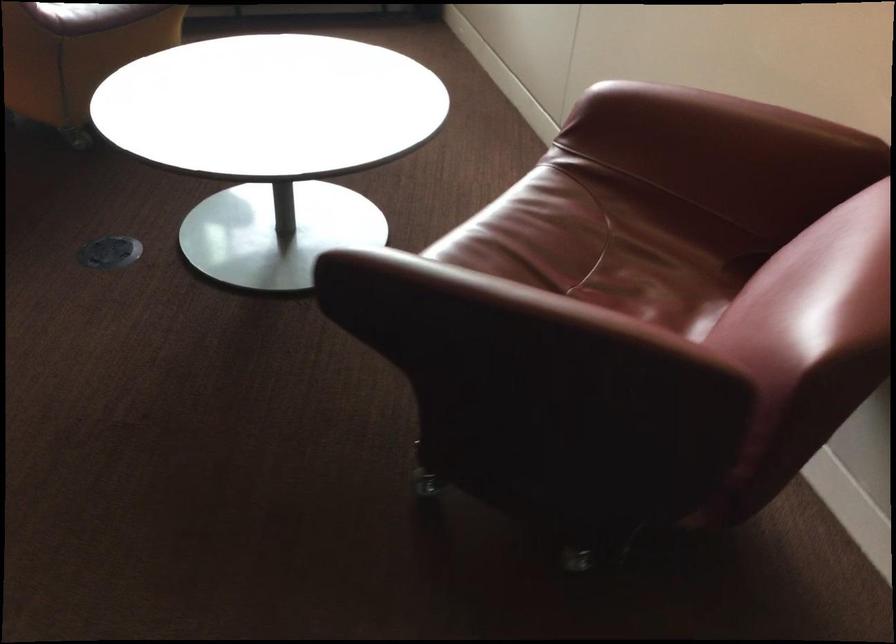
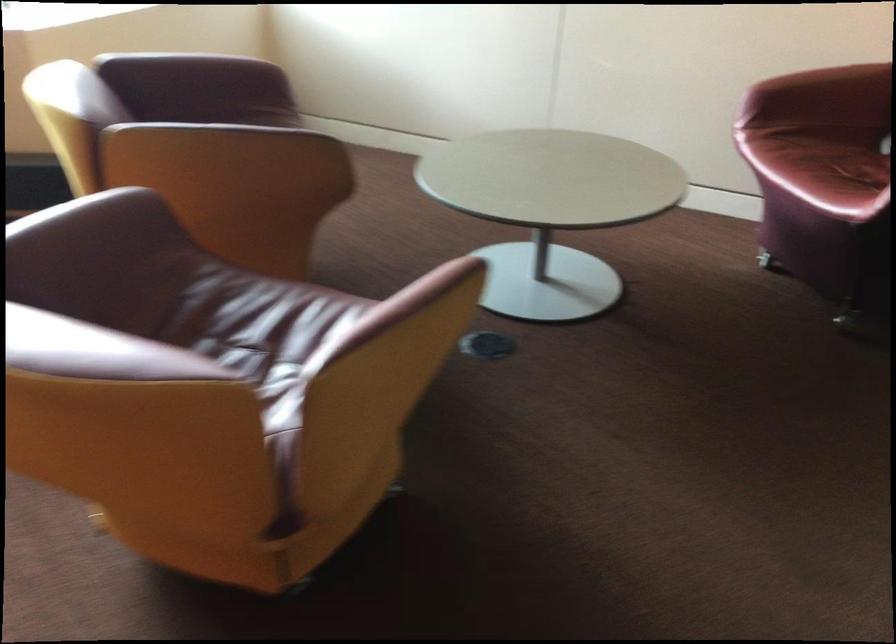
Locate, in the second image, the point that corresponds to [659,156] in the first image.

(822, 95)